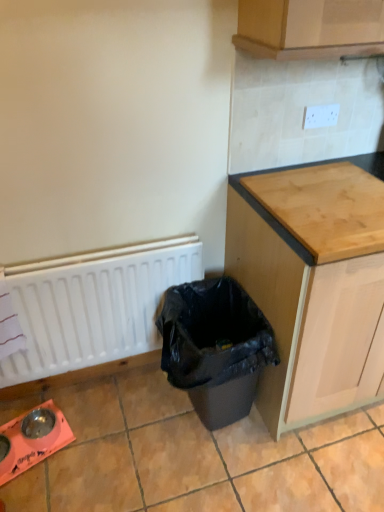
Question: Is white matte radiator at lower left looking in the opposite direction of light brown wood at upper right?

Choices:
 (A) no
 (B) yes

Answer: (A)

Question: Is white matte radiator at lower left taller than light brown wood at upper right?

Choices:
 (A) no
 (B) yes

Answer: (B)

Question: Is white matte radiator at lower left bigger than light brown wood at upper right?

Choices:
 (A) yes
 (B) no

Answer: (A)

Question: Does white matte radiator at lower left have a lesser height compared to light brown wood at upper right?

Choices:
 (A) yes
 (B) no

Answer: (B)

Question: Considering the relative sizes of white matte radiator at lower left and light brown wood at upper right in the image provided, is white matte radiator at lower left thinner than light brown wood at upper right?

Choices:
 (A) no
 (B) yes

Answer: (B)

Question: From a real-world perspective, is white matte radiator at lower left under light brown wood at upper right?

Choices:
 (A) no
 (B) yes

Answer: (B)

Question: From a real-world perspective, is black plastic waste bin at lower center over light brown wood at upper right?

Choices:
 (A) no
 (B) yes

Answer: (A)

Question: Considering the relative sizes of black plastic waste bin at lower center and light brown wood at upper right in the image provided, is black plastic waste bin at lower center smaller than light brown wood at upper right?

Choices:
 (A) no
 (B) yes

Answer: (A)

Question: From the image's perspective, is black plastic waste bin at lower center on top of light brown wood at upper right?

Choices:
 (A) yes
 (B) no

Answer: (B)

Question: Is black plastic waste bin at lower center shorter than light brown wood at upper right?

Choices:
 (A) no
 (B) yes

Answer: (A)

Question: Can you confirm if black plastic waste bin at lower center is thinner than light brown wood at upper right?

Choices:
 (A) no
 (B) yes

Answer: (B)

Question: Is black plastic waste bin at lower center to the right of light brown wood at upper right from the viewer's perspective?

Choices:
 (A) no
 (B) yes

Answer: (A)

Question: Does light brown wood at upper right turn towards white matte radiator at lower left?

Choices:
 (A) yes
 (B) no

Answer: (B)